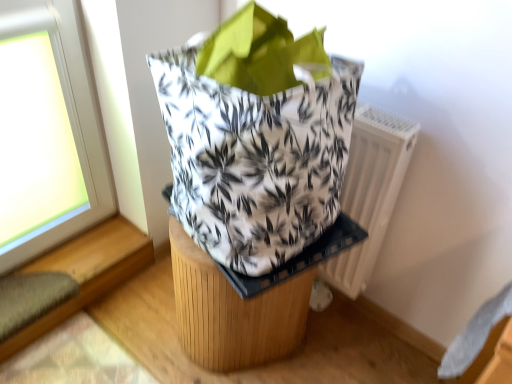
Describe the element at coordinates (370, 191) in the screenshot. Image resolution: width=512 pixels, height=384 pixels. I see `white plastic radiator at right` at that location.

You are a GUI agent. You are given a task and a screenshot of the screen. Output one action in this format:
    pyautogui.click(x=<x>, y=<y>)
    Task: Click on the wooden stool at center
    Image resolution: width=512 pixels, height=384 pixels.
    Given the screenshot: What is the action you would take?
    pyautogui.click(x=247, y=301)

Relative to white printed fabric grocery bag at center, is white plastic radiator at right in front or behind?

white plastic radiator at right is positioned farther from the viewer than white printed fabric grocery bag at center.

In terms of size, does white plastic radiator at right appear bigger or smaller than white printed fabric grocery bag at center?

Clearly, white plastic radiator at right is smaller in size than white printed fabric grocery bag at center.

Is white plastic radiator at right to the left or to the right of white printed fabric grocery bag at center in the image?

white plastic radiator at right is positioned on white printed fabric grocery bag at center's right side.

Can you tell me how much white plastic radiator at right and white printed fabric grocery bag at center differ in facing direction?

There is a 4.13-degree angle between the facing directions of white plastic radiator at right and white printed fabric grocery bag at center.

At what (x,y) coordinates should I click in order to perform the action: click on furniture behind the white printed fabric grocery bag at center. Please return your answer as a coordinate pair (x, y). Looking at the image, I should click on (247, 301).

Is white printed fabric grocery bag at center looking in the opposite direction of wooden stool at center?

No, wooden stool at center is not at the back of white printed fabric grocery bag at center.

Which is in front, point (192, 127) or point (187, 293)?

The point (192, 127) is closer to the camera.

Is white plastic radiator at right at the back of white printed fabric grocery bag at center?

No, white plastic radiator at right is not at the back of white printed fabric grocery bag at center.

Is white printed fabric grocery bag at center next to white plastic radiator at right and touching it?

No.

Which object is closer to the camera taking this photo, white printed fabric grocery bag at center or white plastic radiator at right?

Positioned in front is white printed fabric grocery bag at center.

Between point (280, 355) and point (394, 131), which one is positioned in front?

The point (394, 131) is in front.

Considering their positions, is wooden stool at center located in front of or behind white plastic radiator at right?

In the image, wooden stool at center appears in front of white plastic radiator at right.

From the image's perspective, is wooden stool at center under white plastic radiator at right?

Indeed, from the image's perspective, wooden stool at center is shown beneath white plastic radiator at right.

How many degrees apart are the facing directions of wooden stool at center and white plastic radiator at right?

The facing directions of wooden stool at center and white plastic radiator at right are 0.312 degrees apart.

At what (x,y) coordinates should I click in order to perform the action: click on furniture on the left of the white printed fabric grocery bag at center. Please return your answer as a coordinate pair (x, y). The height and width of the screenshot is (384, 512). Looking at the image, I should click on (247, 301).

How many degrees apart are the facing directions of wooden stool at center and white printed fabric grocery bag at center?

They differ by 4.44 degrees in their facing directions.

Which object is positioned more to the right, wooden stool at center or white printed fabric grocery bag at center?

From the viewer's perspective, white printed fabric grocery bag at center appears more on the right side.

Is wooden stool at center aimed at white printed fabric grocery bag at center?

No, wooden stool at center is not oriented towards white printed fabric grocery bag at center.

Based on their positions, is white plastic radiator at right located to the left or right of wooden stool at center?

From the image, it's evident that white plastic radiator at right is to the right of wooden stool at center.

What are the coordinates of `furniture in front of the white plastic radiator at right` in the screenshot? It's located at (247, 301).

How distant is white plastic radiator at right from wooden stool at center?

A distance of 11.47 inches exists between white plastic radiator at right and wooden stool at center.

Considering the relative sizes of white plastic radiator at right and wooden stool at center in the image provided, is white plastic radiator at right wider than wooden stool at center?

In fact, white plastic radiator at right might be narrower than wooden stool at center.

Identify the location of grocery bag lying above the white plastic radiator at right (from the image's perspective). (255, 160).

Image resolution: width=512 pixels, height=384 pixels. I want to click on furniture below the white printed fabric grocery bag at center (from a real-world perspective), so click(x=247, y=301).

Based on the photo, when comparing their distances from wooden stool at center, does white plastic radiator at right or white printed fabric grocery bag at center seem closer?

Among the two, white printed fabric grocery bag at center is located nearer to wooden stool at center.

Estimate the real-world distances between objects in this image. Which object is closer to wooden stool at center, white printed fabric grocery bag at center or white plastic radiator at right?

white printed fabric grocery bag at center.

From the image, which object appears to be nearer to white printed fabric grocery bag at center, wooden stool at center or white plastic radiator at right?

The object closer to white printed fabric grocery bag at center is wooden stool at center.

Which object lies nearer to the anchor point white plastic radiator at right, white printed fabric grocery bag at center or wooden stool at center?

Among the two, wooden stool at center is located nearer to white plastic radiator at right.

Considering their positions, is wooden stool at center positioned further to white plastic radiator at right than white printed fabric grocery bag at center?

Among the two, white printed fabric grocery bag at center is located further to white plastic radiator at right.

Based on their spatial positions, is white plastic radiator at right or wooden stool at center further from white printed fabric grocery bag at center?

white plastic radiator at right is positioned further to the anchor white printed fabric grocery bag at center.

Locate an element on the screen. furniture positioned between white printed fabric grocery bag at center and white plastic radiator at right from near to far is located at coordinates pos(247,301).